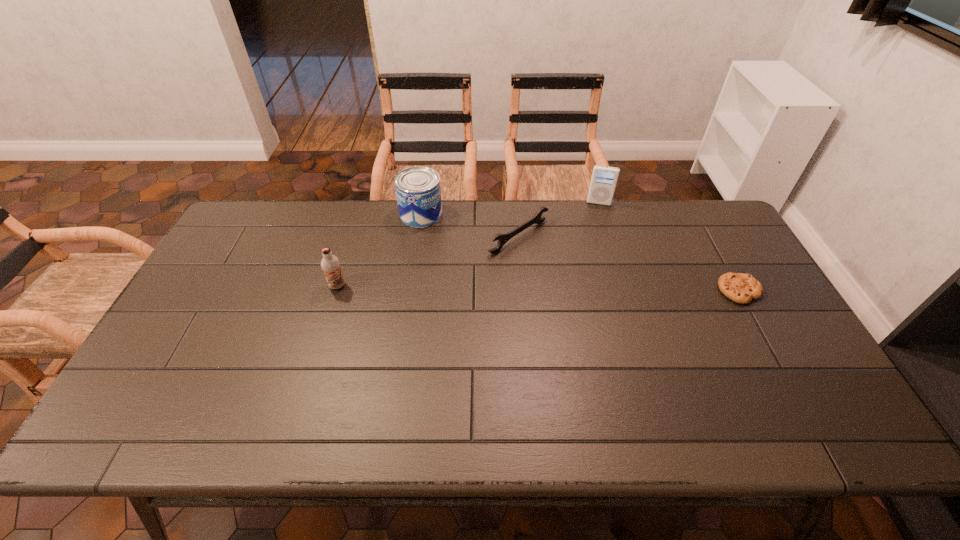
Locate an element on the screen. Image resolution: width=960 pixels, height=540 pixels. vacant spot on the desktop that is between the leftmost object and the shortest object and is positioned on the open ends of the third object from left to right is located at coordinates (597, 289).

This screenshot has height=540, width=960. In order to click on vacant space on the desktop that is between the leftmost object and the cookie and is positioned on the front label of the second object from left to right in this screenshot , I will do `click(483, 288)`.

At what (x,y) coordinates should I click in order to perform the action: click on free spot on the desktop that is between the chocolate milk and the cookie and is positioned on the front-facing side of the iPod. Please return your answer as a coordinate pair (x, y). Looking at the image, I should click on (592, 289).